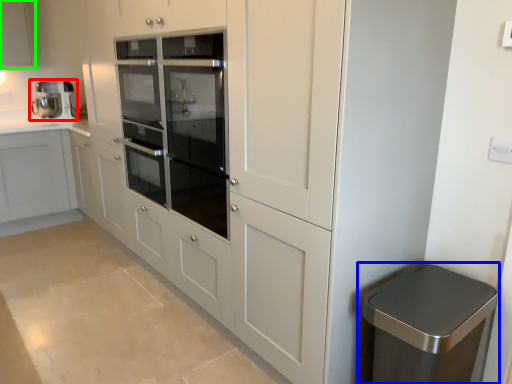
Question: Considering the real-world distances, which object is closest to home appliance (highlighted by a red box)? waste container (highlighted by a blue box) or cabinetry (highlighted by a green box).

Choices:
 (A) waste container
 (B) cabinetry

Answer: (B)